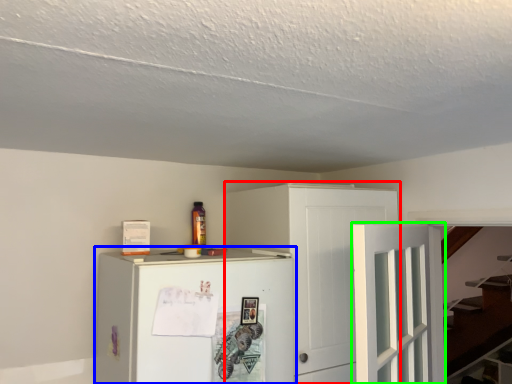
Question: Which is nearer to the cabinetry (highlighted by a red box)? refrigerator (highlighted by a blue box) or door (highlighted by a green box).

Choices:
 (A) refrigerator
 (B) door

Answer: (A)